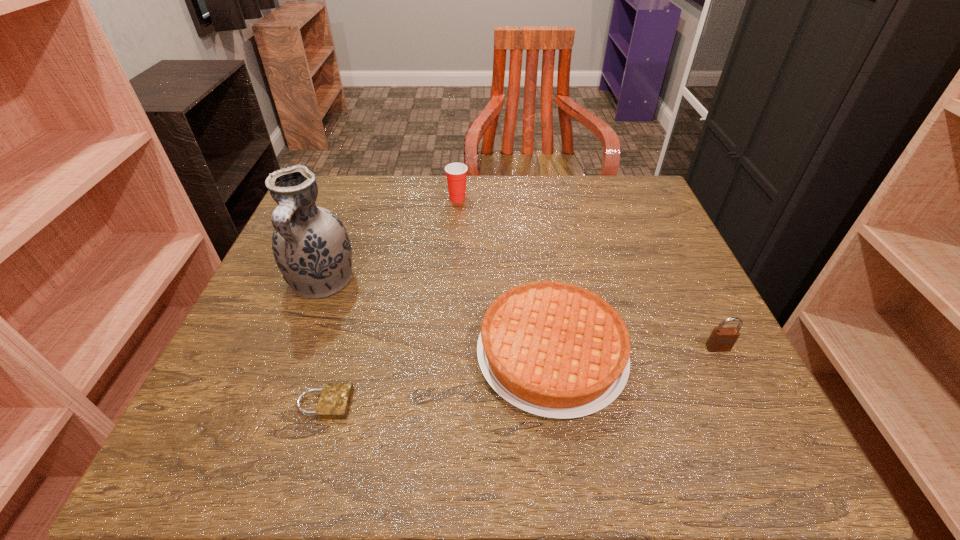
Image resolution: width=960 pixels, height=540 pixels. Find the location of `free space between the tallest object and the left padlock`. free space between the tallest object and the left padlock is located at coordinates (324, 343).

I want to click on blank region between the third object from right to left and the shorter padlock, so click(x=391, y=301).

The width and height of the screenshot is (960, 540). Identify the location of blank region between the vase and the third object from left to right. (x=390, y=240).

The width and height of the screenshot is (960, 540). I want to click on vacant point located between the Dixie cup and the left padlock, so click(391, 301).

Find the location of `free space between the vase and the fourth tallest object`. free space between the vase and the fourth tallest object is located at coordinates (437, 319).

You are a GUI agent. You are given a task and a screenshot of the screen. Output one action in this format:
    pyautogui.click(x=<x>, y=<y>)
    Task: Click on the blank region between the farthest object and the taller padlock
    This screenshot has height=540, width=960.
    Given the screenshot: What is the action you would take?
    pyautogui.click(x=588, y=273)

At what (x,y) coordinates should I click in order to perform the action: click on free space between the fourth object from left to right and the vase. Please return your answer as a coordinate pair (x, y). This screenshot has height=540, width=960. Looking at the image, I should click on (437, 319).

Locate an element on the screen. This screenshot has height=540, width=960. the second closest object to the nearer padlock is located at coordinates (556, 350).

Where is `the closest object to the second object from right to left`? The image size is (960, 540). the closest object to the second object from right to left is located at coordinates (722, 339).

Image resolution: width=960 pixels, height=540 pixels. I want to click on vacant region that satisfies the following two spatial constraints: 1. on the front side of the third object from right to left; 2. on the keyhole side of the left padlock, so click(444, 403).